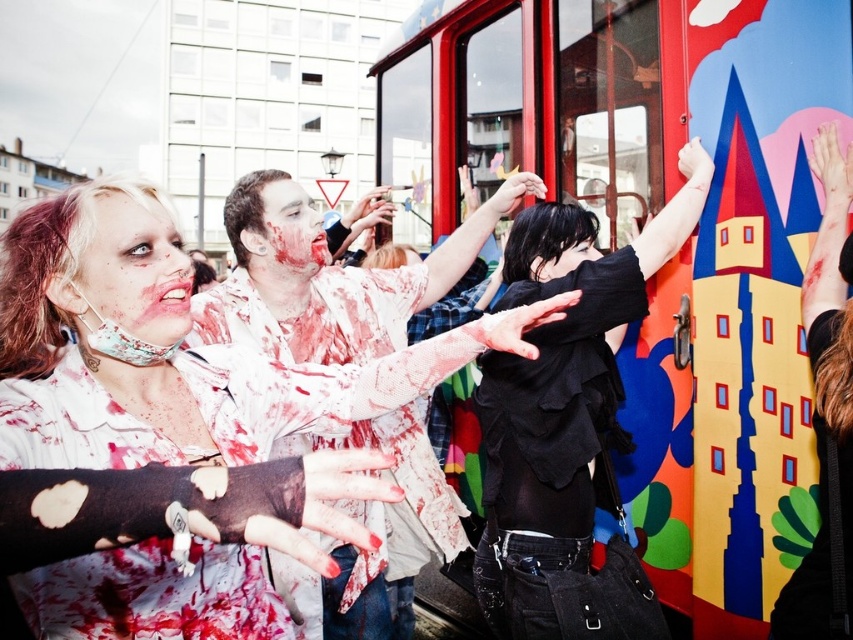
You are organizing a costume party and need to decide which outfit to wear. You have the matte white shirt at center and the black leather jacket at upper right. Which one would you choose if you want to stand out more in the crowd based on their sizes?

The matte white shirt at center has a larger size compared to the black leather jacket at upper right, so choosing the matte white shirt at center would make you stand out more due to its bigger size.

You are a photographer at the zombie event. You need to capture a clear shot of the matte white shirt at center and the smooth black hair at center. Which object should you focus on first to ensure both are in focus?

The matte white shirt at center is located above smooth black hair at center, so you should focus on the matte white shirt at center first to ensure both are in focus since it is closer to the camera.